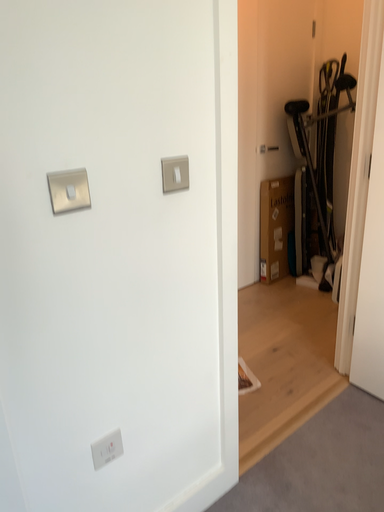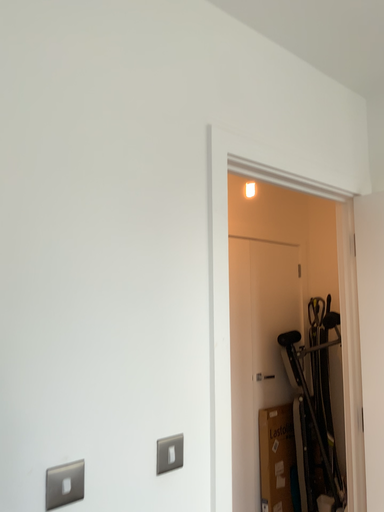
Question: Which way did the camera rotate in the video?

Choices:
 (A) rotated upward
 (B) rotated downward

Answer: (A)